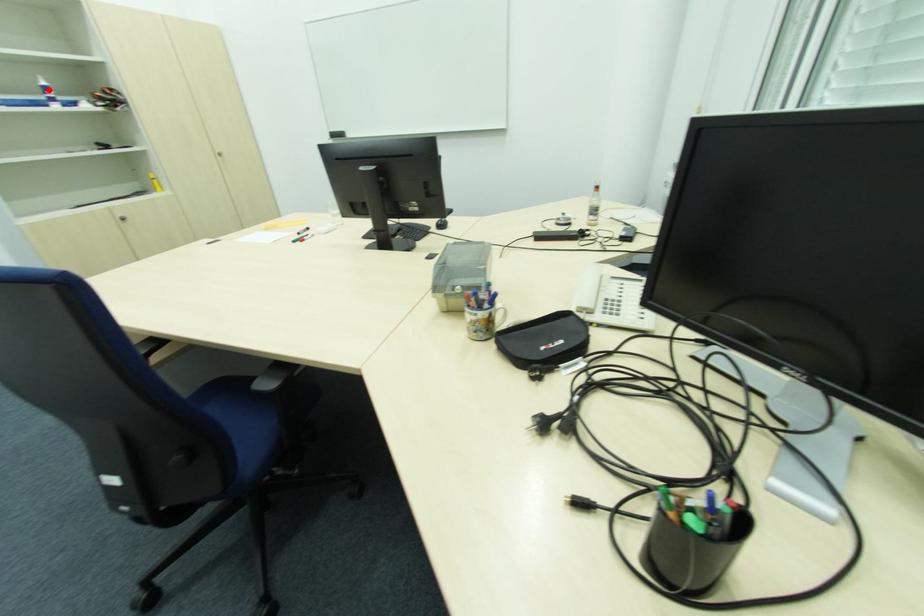
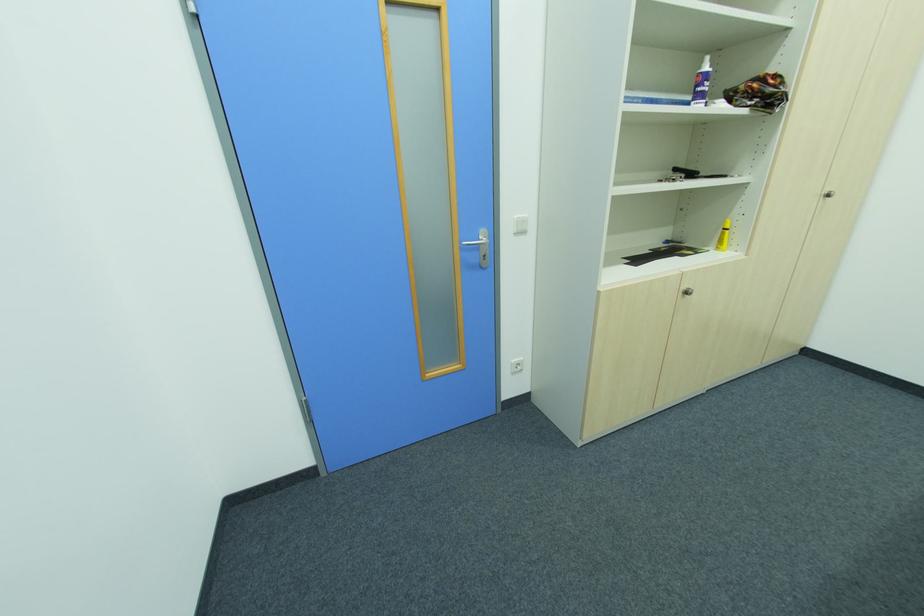
In the second image, find the point that corresponds to the highlighted location in the first image.

(708, 78)